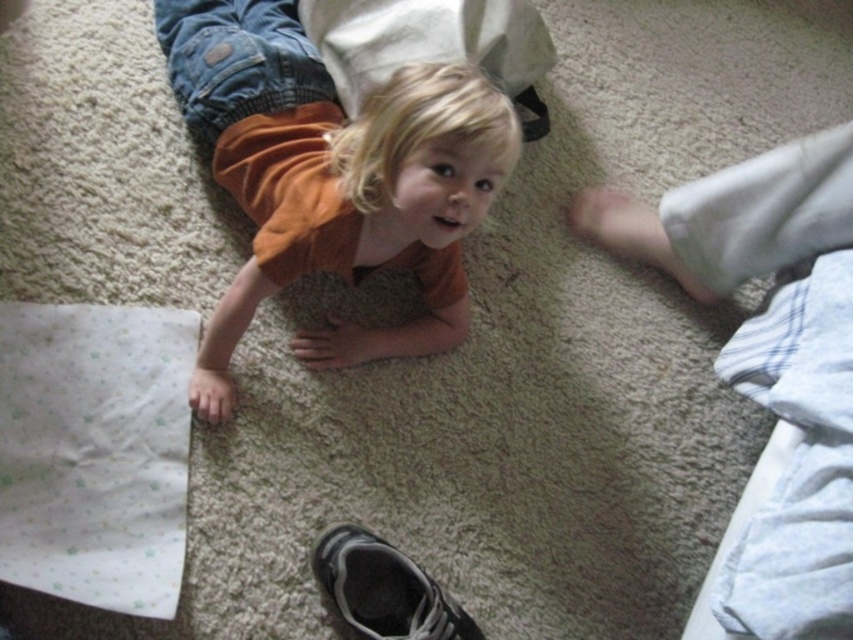
You are a photographer trying to capture a photo of the child. You need to position yourself so that the two points, point (764, 515) and point (389, 582), are both visible in the frame. Based on their positions, which point should you prioritize keeping closer to the camera to ensure both are in view?

Point (764, 515) is in front of point (389, 582), so you should prioritize keeping point (764, 515) closer to the camera to ensure both points are visible in the frame.

You are a photographer setting up a shoot in the scene described. You need to place a small prop between the orange cotton shirt at center and the matte orange shirt at center. Based on their positions, where should you place the prop?

The orange cotton shirt at center is above the matte orange shirt at center, so you should place the prop between them by positioning it below the orange cotton shirt at center and above the matte orange shirt at center.

You are a photographer setting up a shoot in the scene described. You need to place a small prop between the matte orange shirt at center and the black suede shoe at lower center. Based on their sizes, which object should the prop be closer to to ensure it fits within the available space?

The matte orange shirt at center is wider than the black suede shoe at lower center. Therefore, placing the prop closer to the matte orange shirt at center would utilize the wider space effectively.